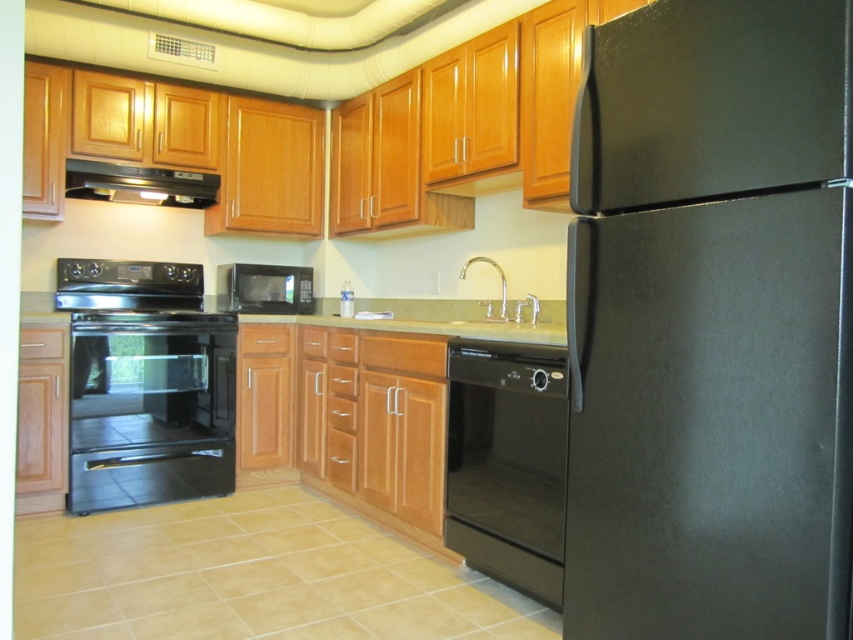
Looking at this image, you are trying to move the black matte refrigerator at right into the space where the black glass oven at lower left currently is. Based on their sizes, will it fit?

The black matte refrigerator at right is thinner than the black glass oven at lower left, so it should fit in the space where the black glass oven at lower left is currently located.

You are a chef preparing to set up a workstation in the kitchen. You have a large cutting board that requires a surface wider than the polished chrome faucet at center. Can you place it on the green granite countertop at center?

The green granite countertop at center has a larger width than the polished chrome faucet at center, so yes, the cutting board can be placed on the green granite countertop at center since it has enough width.

You are organizing the kitchen and need to move items from the black matte refrigerator at right to the black glass oven at lower left. Which direction should you move the items to transfer them?

The black matte refrigerator at right is to the right of the black glass oven at lower left, so you should move the items to the left to transfer them.